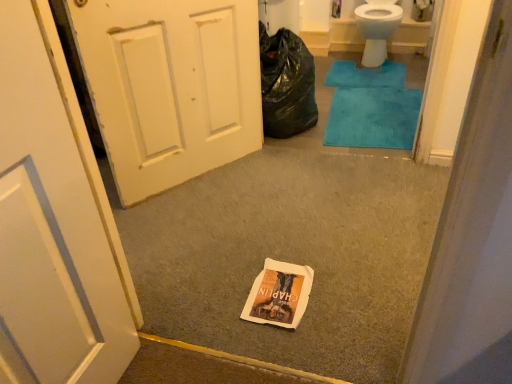
I want to click on free spot in front of white paper bag at center, so click(x=296, y=339).